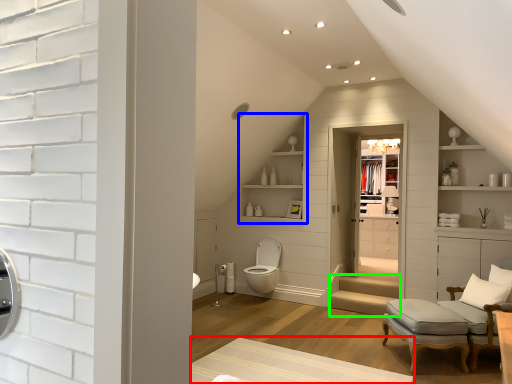
Question: Estimate the real-world distances between objects in this image. Which object is farther from plain (highlighted by a red box), shelf (highlighted by a blue box) or stairwell (highlighted by a green box)?

Choices:
 (A) shelf
 (B) stairwell

Answer: (A)